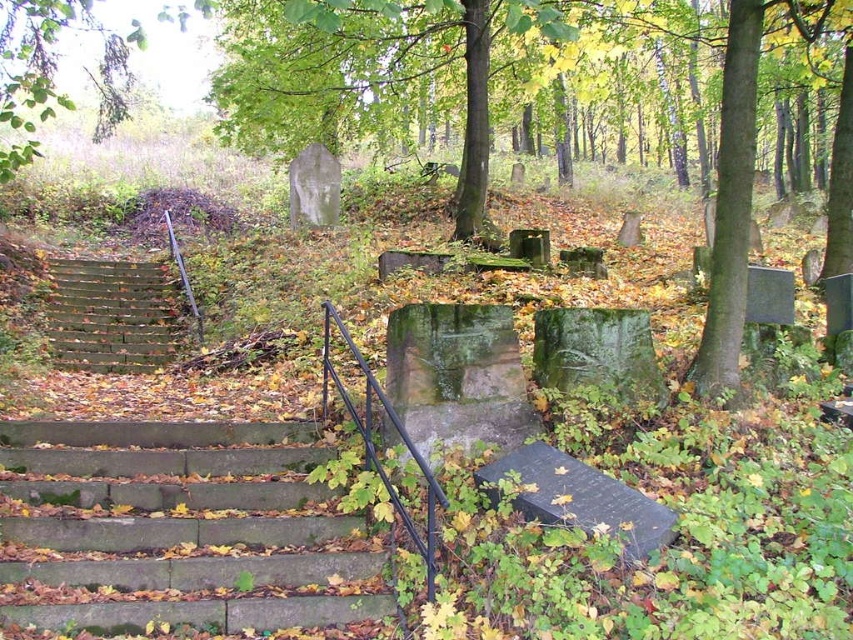
Question: Which point is farther to the camera?

Choices:
 (A) pos(354,84)
 (B) pos(194,545)
 (C) pos(67,300)

Answer: (A)

Question: Is green mossy stone at center below wooden stairs at lower left?

Choices:
 (A) yes
 (B) no

Answer: (B)

Question: Is brown concrete stairs at lower left above wooden stairs at lower left?

Choices:
 (A) yes
 (B) no

Answer: (B)

Question: Considering the real-world distances, which object is closest to the brown concrete stairs at lower left?

Choices:
 (A) green mossy stone at center
 (B) wooden stairs at lower left

Answer: (B)

Question: Can you confirm if green mossy stone at center is smaller than wooden stairs at lower left?

Choices:
 (A) yes
 (B) no

Answer: (B)

Question: Considering the real-world distances, which object is closest to the wooden stairs at lower left?

Choices:
 (A) brown concrete stairs at lower left
 (B) green mossy stone at center

Answer: (A)